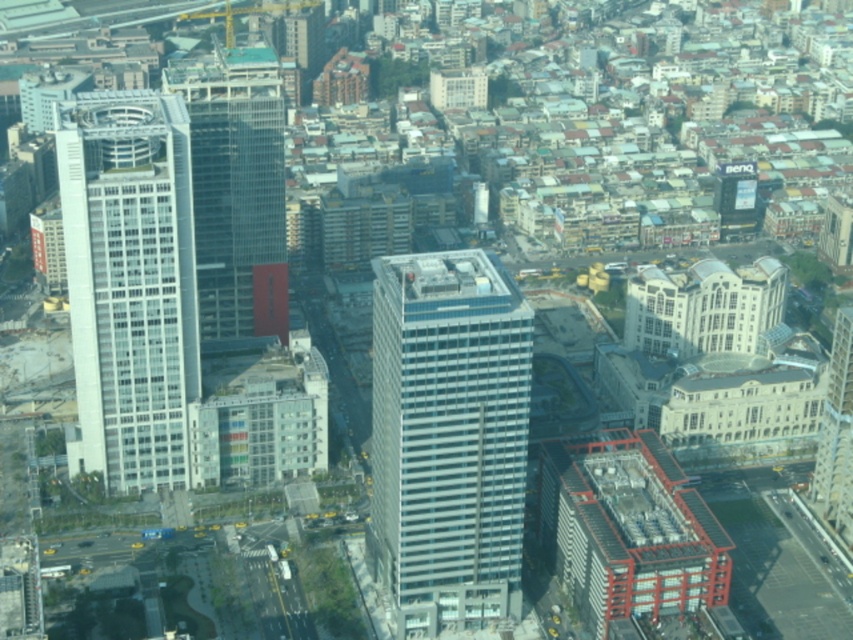
Question: Is white glass building at left bigger than glassy steel skyscraper at center?

Choices:
 (A) yes
 (B) no

Answer: (A)

Question: Is glassy white skyscraper at center thinner than white glass building at left?

Choices:
 (A) no
 (B) yes

Answer: (B)

Question: Estimate the real-world distances between objects in this image. Which object is closer to the white glass building at left?

Choices:
 (A) glassy white skyscraper at center
 (B) glassy skyscraper at center-left
 (C) glassy steel skyscraper at center

Answer: (B)

Question: Which object appears farthest from the camera in this image?

Choices:
 (A) white glass building at left
 (B) glassy skyscraper at center-left
 (C) glassy white skyscraper at center
 (D) glassy steel skyscraper at center

Answer: (D)

Question: Can you confirm if white glass building at left is smaller than glassy steel skyscraper at center?

Choices:
 (A) no
 (B) yes

Answer: (A)

Question: Among these points, which one is farthest from the camera?

Choices:
 (A) (457, 410)
 (B) (828, 433)
 (C) (231, 99)
 (D) (138, 362)

Answer: (C)